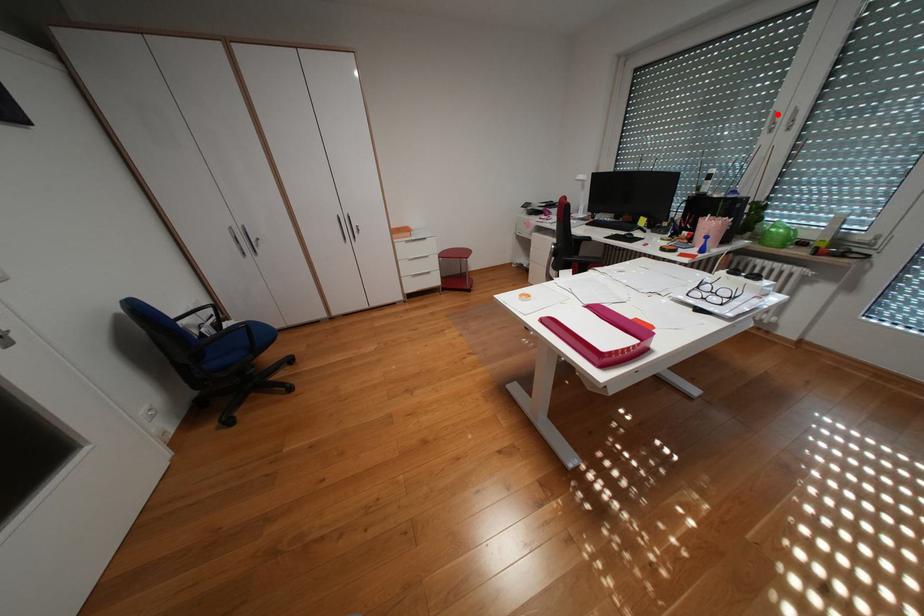
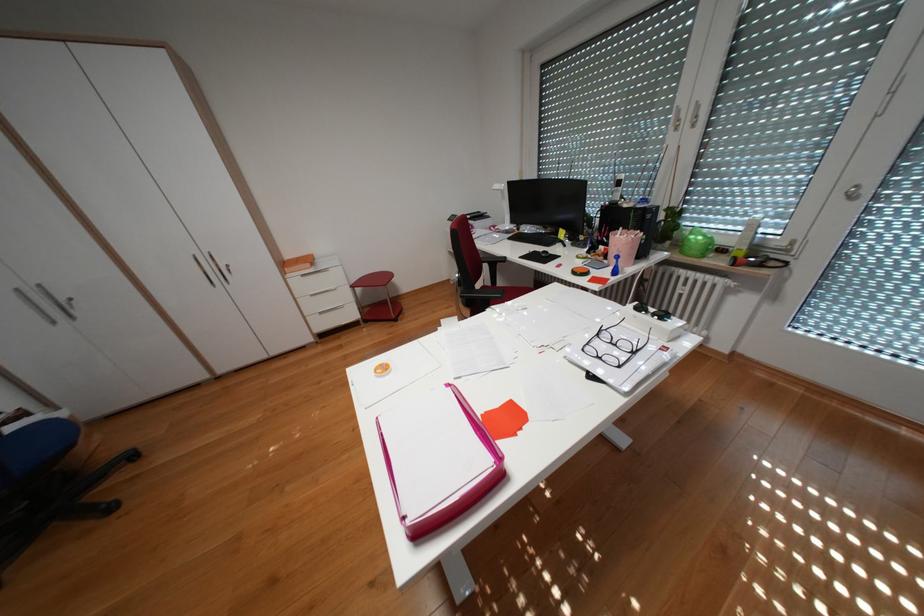
Where in the second image is the point corresponding to the highlighted location from the first image?

(682, 111)